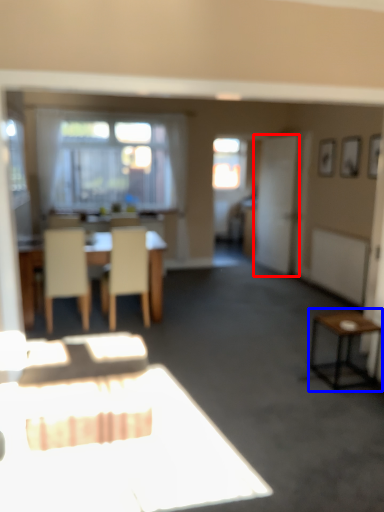
Question: Which object appears farthest to the camera in this image, screen door (highlighted by a red box) or side table (highlighted by a blue box)?

Choices:
 (A) screen door
 (B) side table

Answer: (A)